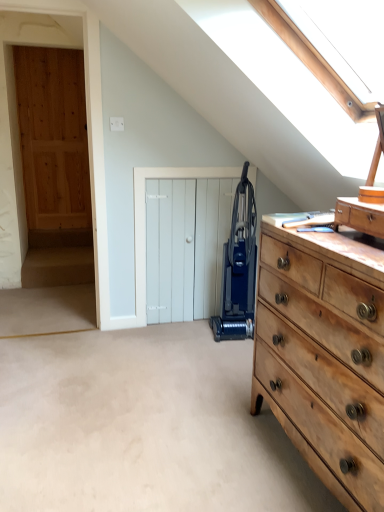
Based on the photo, measure the distance between point [237,221] and camera.

Point [237,221] and camera are 8.74 feet apart from each other.

This screenshot has width=384, height=512. What are the coordinates of `white wooden door at center` in the screenshot? It's located at (145, 218).

In order to click on natural wood dresser at right in this screenshot , I will do `click(325, 354)`.

Is wooden drawer at right not near blue plastic vacuum cleaner at center?

Yes.

Would you say wooden drawer at right contains blue plastic vacuum cleaner at center?

Actually, blue plastic vacuum cleaner at center is outside wooden drawer at right.

Which of these two, wooden drawer at right or blue plastic vacuum cleaner at center, is thinner?

wooden drawer at right.

From a real-world perspective, is wooden drawer at right located higher than blue plastic vacuum cleaner at center?

Yes.

Does natural wood dresser at right contain white wooden door at center?

No, natural wood dresser at right does not contain white wooden door at center.

Considering the relative sizes of natural wood dresser at right and white wooden door at center in the image provided, is natural wood dresser at right thinner than white wooden door at center?

In fact, natural wood dresser at right might be wider than white wooden door at center.

From the image's perspective, which object appears higher, natural wood dresser at right or white wooden door at center?

From the image's view, white wooden door at center is above.

Is white wooden door at center taller than blue plastic vacuum cleaner at center?

In fact, white wooden door at center may be shorter than blue plastic vacuum cleaner at center.

From the image's perspective, is white wooden door at center located above or below blue plastic vacuum cleaner at center?

white wooden door at center is above blue plastic vacuum cleaner at center.

Looking at this image, is blue plastic vacuum cleaner at center completely or partially inside white wooden door at center?

No, blue plastic vacuum cleaner at center is located outside of white wooden door at center.

How many degrees apart are the facing directions of white wooden door at center and blue plastic vacuum cleaner at center?

They differ by 4.49 degrees in their facing directions.

Which is more to the left, white wooden door at center or natural wood dresser at right?

Positioned to the left is white wooden door at center.

Is point (136, 228) more distant than point (287, 239)?

Yes, it is behind point (287, 239).

In terms of height, does white wooden door at center look taller or shorter compared to natural wood dresser at right?

Considering their sizes, white wooden door at center has more height than natural wood dresser at right.

The image size is (384, 512). What are the coordinates of `door above the natural wood dresser at right (from the image's perspective)` in the screenshot? It's located at (145, 218).

Is wooden drawer at right at the back of white wooden door at center?

No.

Which is more to the right, white wooden door at center or wooden drawer at right?

Positioned to the right is wooden drawer at right.

Between white wooden door at center and wooden drawer at right, which one has larger size?

white wooden door at center is bigger.

Between white wooden door at center and wooden drawer at right, which one has less height?

wooden drawer at right.

Based on the photo, is wooden drawer at right not within white wooden door at center?

Yes.

From a real-world perspective, who is located lower, wooden drawer at right or white wooden door at center?

white wooden door at center is physically lower.

Is wooden drawer at right next to white wooden door at center?

wooden drawer at right and white wooden door at center are clearly separated.

Does wooden drawer at right have a larger size compared to white wooden door at center?

Actually, wooden drawer at right might be smaller than white wooden door at center.

Considering the relative positions of wooden drawer at right and natural wood dresser at right in the image provided, is wooden drawer at right to the right of natural wood dresser at right from the viewer's perspective?

No, wooden drawer at right is not to the right of natural wood dresser at right.

Is wooden drawer at right wider than natural wood dresser at right?

No.

Considering the sizes of wooden drawer at right and natural wood dresser at right in the image, is wooden drawer at right taller or shorter than natural wood dresser at right?

Clearly, wooden drawer at right is shorter compared to natural wood dresser at right.

Which is behind, wooden drawer at right or natural wood dresser at right?

wooden drawer at right is more distant.

Where is `drawer on the right side of blue plastic vacuum cleaner at center`? drawer on the right side of blue plastic vacuum cleaner at center is located at coordinates (360, 216).

In the image, there is a natural wood dresser at right. Where is `door above it (from the image's perspective)`? door above it (from the image's perspective) is located at coordinates (145, 218).

Estimate the real-world distances between objects in this image. Which object is further from natural wood dresser at right, wooden drawer at right or blue plastic vacuum cleaner at center?

The object further to natural wood dresser at right is blue plastic vacuum cleaner at center.

Considering their positions, is blue plastic vacuum cleaner at center positioned further to white wooden door at center than wooden drawer at right?

Among the two, wooden drawer at right is located further to white wooden door at center.

Based on their spatial positions, is natural wood dresser at right or white wooden door at center closer to blue plastic vacuum cleaner at center?

Based on the image, white wooden door at center appears to be nearer to blue plastic vacuum cleaner at center.

Estimate the real-world distances between objects in this image. Which object is further from wooden drawer at right, blue plastic vacuum cleaner at center or white wooden door at center?

white wooden door at center lies further to wooden drawer at right than the other object.

Looking at the image, which one is located further to blue plastic vacuum cleaner at center, wooden drawer at right or white wooden door at center?

wooden drawer at right is further to blue plastic vacuum cleaner at center.

Which object lies nearer to the anchor point wooden drawer at right, natural wood dresser at right or white wooden door at center?

Among the two, natural wood dresser at right is located nearer to wooden drawer at right.

When comparing their distances from white wooden door at center, does blue plastic vacuum cleaner at center or natural wood dresser at right seem closer?

Based on the image, blue plastic vacuum cleaner at center appears to be nearer to white wooden door at center.

From the image, which object appears to be farther from natural wood dresser at right, wooden drawer at right or white wooden door at center?

Based on the image, white wooden door at center appears to be further to natural wood dresser at right.

Find the location of a particular element. appliance between wooden drawer at right and white wooden door at center along the z-axis is located at coordinates click(x=239, y=268).

You are a GUI agent. You are given a task and a screenshot of the screen. Output one action in this format:
    pyautogui.click(x=<x>, y=<y>)
    Task: Click on the drawer between natural wood dresser at right and white wooden door at center along the z-axis
    Image resolution: width=384 pixels, height=512 pixels.
    Given the screenshot: What is the action you would take?
    pyautogui.click(x=360, y=216)

The width and height of the screenshot is (384, 512). I want to click on drawer between natural wood dresser at right and blue plastic vacuum cleaner at center from front to back, so click(360, 216).

Where is `appliance positioned between natural wood dresser at right and white wooden door at center from near to far`? The height and width of the screenshot is (512, 384). appliance positioned between natural wood dresser at right and white wooden door at center from near to far is located at coordinates (239, 268).